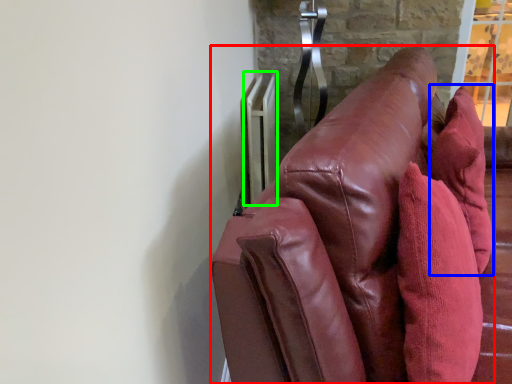
Question: Which is nearer to the furniture (highlighted by a red box)? throw pillow (highlighted by a blue box) or radiator (highlighted by a green box).

Choices:
 (A) throw pillow
 (B) radiator

Answer: (A)